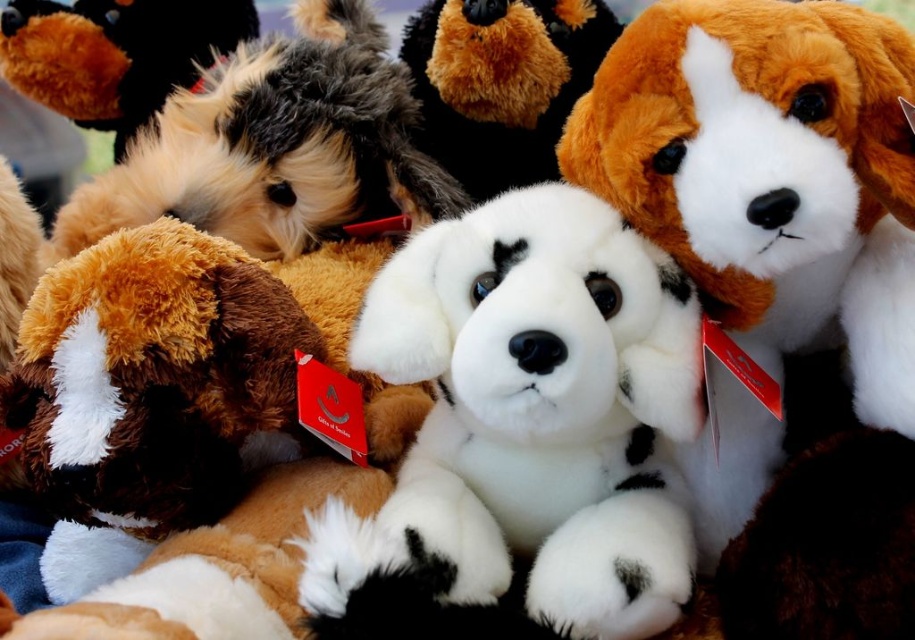
Question: Does brown plush dog at left have a greater width compared to fluffy brown dog at upper center?

Choices:
 (A) no
 (B) yes

Answer: (B)

Question: Based on their relative distances, which object is nearer to the fluffy brown dog at center?

Choices:
 (A) white plush dog at center
 (B) brown plush dog at left
 (C) white soft plush dog at center
 (D) fluffy brown dog at upper center

Answer: (D)

Question: Which object is farther from the camera taking this photo?

Choices:
 (A) fluffy brown dog at center
 (B) white soft plush dog at center
 (C) brown plush dog at left

Answer: (A)

Question: Can you confirm if fluffy brown dog at center is positioned to the left of fluffy brown dog at upper center?

Choices:
 (A) no
 (B) yes

Answer: (B)

Question: Is white plush dog at center positioned in front of fluffy brown dog at center?

Choices:
 (A) yes
 (B) no

Answer: (A)

Question: Which of the following is the closest to the observer?

Choices:
 (A) white plush dog at center
 (B) white soft plush dog at center
 (C) fluffy brown dog at upper center

Answer: (B)